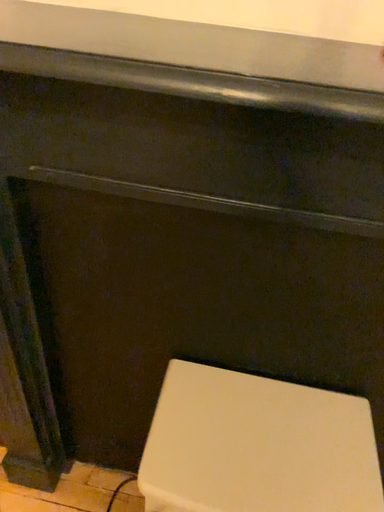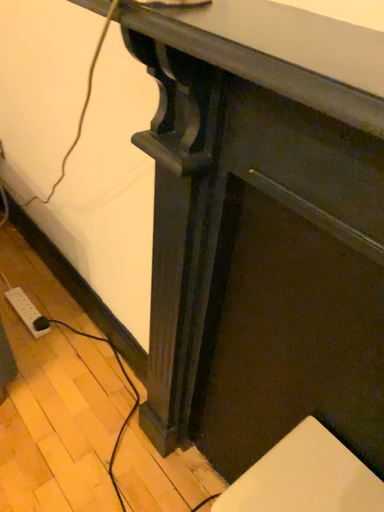
Question: Which way did the camera rotate in the video?

Choices:
 (A) rotated downward
 (B) rotated upward

Answer: (B)